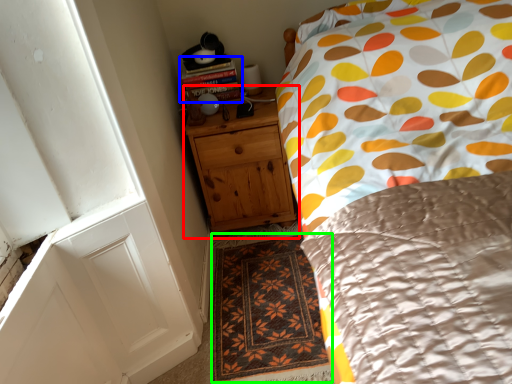
Question: Based on their relative distances, which object is farther from chest of drawers (highlighted by a red box)? Choose from book (highlighted by a blue box) and doormat (highlighted by a green box).

Choices:
 (A) book
 (B) doormat

Answer: (B)